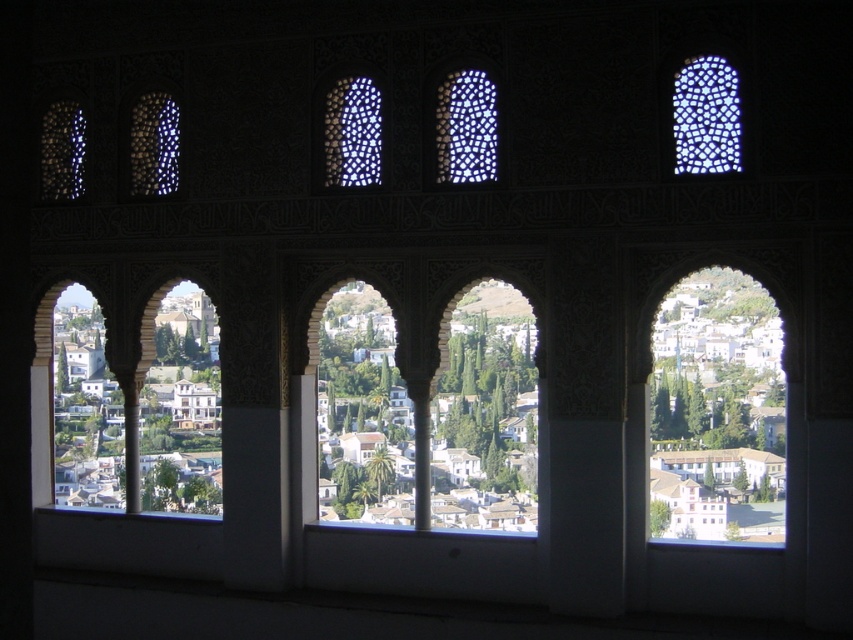
Question: Is translucent mosaic at upper right to the left of white mosaic tile at center from the viewer's perspective?

Choices:
 (A) yes
 (B) no

Answer: (B)

Question: Is white mosaic tile at center smaller than translucent mosaic tile at left?

Choices:
 (A) no
 (B) yes

Answer: (A)

Question: Which of the following is the farthest from the observer?

Choices:
 (A) translucent mosaic at upper right
 (B) translucent mosaic tile at center

Answer: (B)

Question: Does translucent mosaic tile at center have a greater width compared to translucent mosaic tile at left?

Choices:
 (A) no
 (B) yes

Answer: (B)

Question: Which point is closer to the camera?

Choices:
 (A) (166, 192)
 (B) (480, 442)
 (C) (80, 166)
 (D) (689, 90)

Answer: (D)

Question: Estimate the real-world distances between objects in this image. Which object is closer to the green stone archway at center?

Choices:
 (A) translucent mosaic tile at center
 (B) translucent glass lattice at upper left
 (C) translucent mosaic tile at left

Answer: (A)